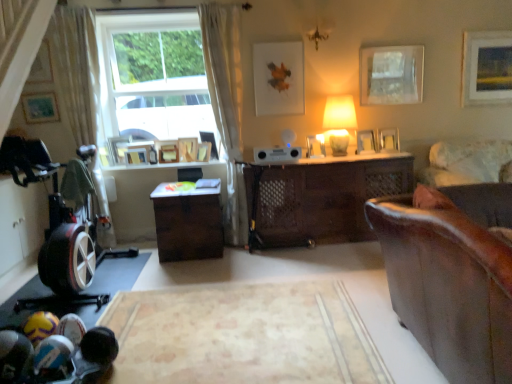
What are the coordinates of `free space in front of wooden cabinet at center, the first desk when ordered from right to left` in the screenshot? It's located at (315, 277).